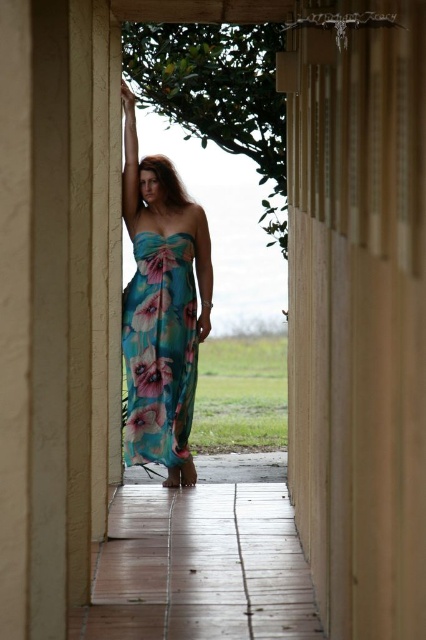
Question: Can you confirm if floral chiffon dress at center is positioned above floral print fabric dress at center?

Choices:
 (A) yes
 (B) no

Answer: (A)

Question: Which point is farther to the camera?

Choices:
 (A) (132, 276)
 (B) (155, 396)

Answer: (A)

Question: Which point is closer to the camera?

Choices:
 (A) (175, 452)
 (B) (178, 376)

Answer: (B)

Question: Does floral chiffon dress at center have a larger size compared to floral print fabric dress at center?

Choices:
 (A) yes
 (B) no

Answer: (A)

Question: Does floral chiffon dress at center have a larger size compared to floral print fabric dress at center?

Choices:
 (A) no
 (B) yes

Answer: (B)